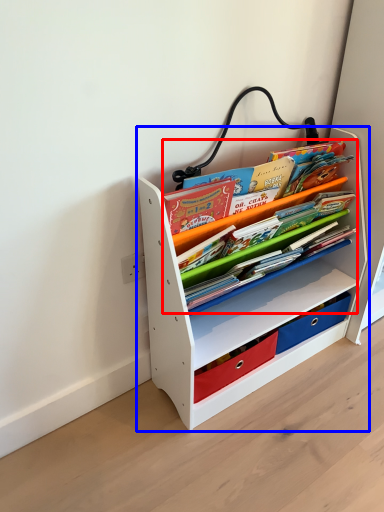
Question: Which point is further to the camera, book (highlighted by a red box) or shelf (highlighted by a blue box)?

Choices:
 (A) book
 (B) shelf

Answer: (A)